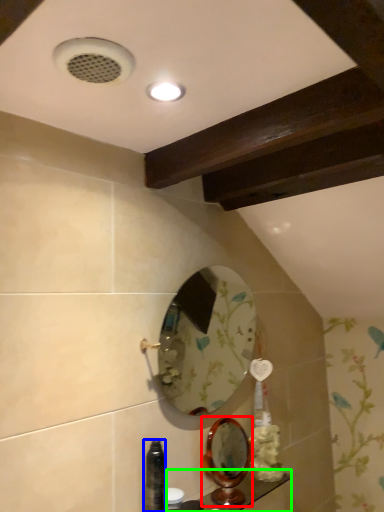
Question: Which is farther away from mirror (highlighted by a red box)? bottle (highlighted by a blue box) or counter top (highlighted by a green box)?

Choices:
 (A) bottle
 (B) counter top

Answer: (A)